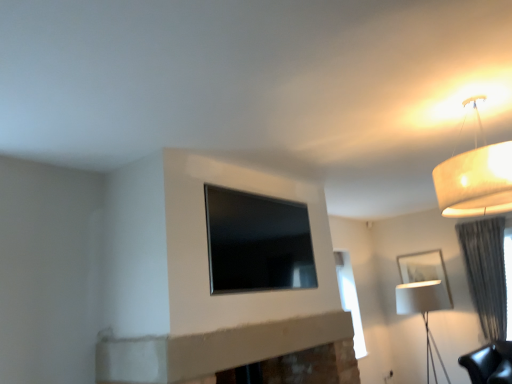
What do you see at coordinates (486, 272) in the screenshot?
I see `gray textured curtain at right` at bounding box center [486, 272].

Image resolution: width=512 pixels, height=384 pixels. What are the coordinates of `matte white lampshade at upper right, the first lamp from the front` in the screenshot? It's located at (475, 177).

Measure the distance between white matte picture frame at right and camera.

white matte picture frame at right and camera are 5.87 meters apart.

Where is `white fabric lampshade at right, the first lamp viewed from the back`? This screenshot has height=384, width=512. white fabric lampshade at right, the first lamp viewed from the back is located at coordinates (424, 311).

This screenshot has height=384, width=512. Find the location of `gray textured curtain at right`. gray textured curtain at right is located at coordinates (486, 272).

From a real-world perspective, who is located higher, white matte picture frame at right or gray textured curtain at right?

From a 3D spatial view, white matte picture frame at right is above.

Do you think white matte picture frame at right is within gray textured curtain at right, or outside of it?

white matte picture frame at right cannot be found inside gray textured curtain at right.

Is white matte picture frame at right further to the viewer compared to gray textured curtain at right?

Yes, it is behind gray textured curtain at right.

Which object is thinner, white matte picture frame at right or gray textured curtain at right?

Thinner between the two is white matte picture frame at right.

From the image's perspective, is white matte picture frame at right above or below black glass window at center?

white matte picture frame at right is below black glass window at center.

Which of these two, white matte picture frame at right or black glass window at center, is wider?

white matte picture frame at right is wider.

Is white matte picture frame at right positioned with its back to black glass window at center?

No.

Is the depth of white matte picture frame at right greater than that of black glass window at center?

Yes, it is.

Locate an element on the screen. This screenshot has height=384, width=512. lamp on the left of white fabric lampshade at right, placed as the second lamp when sorted from top to bottom is located at coordinates (475, 177).

Which point is more forward, (417, 284) or (467, 102)?

Answer: The point (467, 102) is closer to the camera.

From the image's perspective, which object appears higher, white fabric lampshade at right, placed as the 1th lamp when sorted from right to left, or matte white lampshade at upper right, positioned as the second lamp in back-to-front order?

matte white lampshade at upper right, positioned as the second lamp in back-to-front order, is shown above in the image.

Is white fabric lampshade at right, the first lamp viewed from the back, to the left of matte white lampshade at upper right, the second lamp when ordered from bottom to top, from the viewer's perspective?

In fact, white fabric lampshade at right, the first lamp viewed from the back, is to the right of matte white lampshade at upper right, the second lamp when ordered from bottom to top.

From the image's perspective, which is above, matte white lampshade at upper right, which appears as the first lamp when viewed from the top, or black glass window at center?

matte white lampshade at upper right, which appears as the first lamp when viewed from the top, from the image's perspective.

Based on the photo, from a real-world perspective, between matte white lampshade at upper right, the second lamp in the right-to-left sequence, and black glass window at center, who is vertically lower?

In real-world perspective, black glass window at center is lower.

Which is more to the left, matte white lampshade at upper right, positioned as the second lamp in back-to-front order, or black glass window at center?

Positioned to the left is black glass window at center.

Can we say matte white lampshade at upper right, the first lamp from the front, lies outside black glass window at center?

Absolutely, matte white lampshade at upper right, the first lamp from the front, is external to black glass window at center.

Considering the points (209, 190) and (431, 300), which point is behind, point (209, 190) or point (431, 300)?

Point (431, 300)

Looking at this image, from the image's perspective, does black glass window at center appear lower than white fabric lampshade at right, placed as the 1th lamp when sorted from right to left?

No, from the image's perspective, black glass window at center is not beneath white fabric lampshade at right, placed as the 1th lamp when sorted from right to left.

Is black glass window at center positioned far away from white fabric lampshade at right, placed as the 2th lamp when sorted from front to back?

Yes, black glass window at center is far from white fabric lampshade at right, placed as the 2th lamp when sorted from front to back.

Is black glass window at center at the left side of white fabric lampshade at right, placed as the 1th lamp when sorted from right to left?

Correct, you'll find black glass window at center to the left of white fabric lampshade at right, placed as the 1th lamp when sorted from right to left.

From a real-world perspective, which object rests below the other?

white fabric lampshade at right, acting as the 1th lamp starting from the bottom, from a real-world perspective.

Between point (401, 257) and point (412, 304), which one is positioned behind?

The point (401, 257) is farther.

Are white matte picture frame at right and white fabric lampshade at right, placed as the second lamp when sorted from top to bottom, making contact?

Yes, white matte picture frame at right is in contact with white fabric lampshade at right, placed as the second lamp when sorted from top to bottom.

How far apart are white matte picture frame at right and white fabric lampshade at right, acting as the 1th lamp starting from the bottom?

A distance of 8.61 centimeters exists between white matte picture frame at right and white fabric lampshade at right, acting as the 1th lamp starting from the bottom.

Is black glass window at center located within white fabric lampshade at right, placed as the 2th lamp when sorted from front to back?

Definitely not — black glass window at center is not inside white fabric lampshade at right, placed as the 2th lamp when sorted from front to back.

From a real-world perspective, is white fabric lampshade at right, the first lamp viewed from the back, above or below black glass window at center?

From a real-world perspective, white fabric lampshade at right, the first lamp viewed from the back, is physically below black glass window at center.

Considering the sizes of objects white fabric lampshade at right, which is the 2th lamp in left-to-right order, and black glass window at center in the image provided, who is smaller, white fabric lampshade at right, which is the 2th lamp in left-to-right order, or black glass window at center?

black glass window at center is smaller.

Image resolution: width=512 pixels, height=384 pixels. I want to click on picture frame above the gray textured curtain at right (from a real-world perspective), so click(422, 283).

This screenshot has height=384, width=512. Find the location of `picture frame that appears below the black glass window at center (from a real-world perspective)`. picture frame that appears below the black glass window at center (from a real-world perspective) is located at coordinates (422, 283).

Considering their positions, is white matte picture frame at right positioned further to black glass window at center than gray textured curtain at right?

Among the two, white matte picture frame at right is located further to black glass window at center.

Which object lies nearer to the anchor point black glass window at center, matte white lampshade at upper right, the second lamp when ordered from bottom to top, or white fabric lampshade at right, acting as the 1th lamp starting from the bottom?

The object closer to black glass window at center is matte white lampshade at upper right, the second lamp when ordered from bottom to top.

Looking at the image, which one is located closer to gray textured curtain at right, white fabric lampshade at right, placed as the second lamp when sorted from top to bottom, or matte white lampshade at upper right, the first lamp from the front?

Among the two, white fabric lampshade at right, placed as the second lamp when sorted from top to bottom, is located nearer to gray textured curtain at right.

Which object lies further to the anchor point white fabric lampshade at right, placed as the 1th lamp when sorted from right to left, black glass window at center or matte white lampshade at upper right, the second lamp when ordered from bottom to top?

matte white lampshade at upper right, the second lamp when ordered from bottom to top, is further to white fabric lampshade at right, placed as the 1th lamp when sorted from right to left.

Considering their positions, is gray textured curtain at right positioned closer to white fabric lampshade at right, acting as the 1th lamp starting from the bottom, than black glass window at center?

gray textured curtain at right lies closer to white fabric lampshade at right, acting as the 1th lamp starting from the bottom, than the other object.

When comparing their distances from white fabric lampshade at right, acting as the 1th lamp starting from the bottom, does black glass window at center or white matte picture frame at right seem further?

black glass window at center is further to white fabric lampshade at right, acting as the 1th lamp starting from the bottom.

Consider the image. Based on their spatial positions, is matte white lampshade at upper right, which appears as the first lamp when viewed from the top, or gray textured curtain at right further from white fabric lampshade at right, which is the 2th lamp in left-to-right order?

matte white lampshade at upper right, which appears as the first lamp when viewed from the top, is positioned further to the anchor white fabric lampshade at right, which is the 2th lamp in left-to-right order.

Estimate the real-world distances between objects in this image. Which object is further from white matte picture frame at right, white fabric lampshade at right, placed as the 1th lamp when sorted from right to left, or black glass window at center?

Among the two, black glass window at center is located further to white matte picture frame at right.

The image size is (512, 384). I want to click on window between matte white lampshade at upper right, the first lamp from the front, and gray textured curtain at right, along the z-axis, so (257, 242).

Find the location of a particular element. The height and width of the screenshot is (384, 512). lamp positioned between black glass window at center and white matte picture frame at right from near to far is located at coordinates (424, 311).

The width and height of the screenshot is (512, 384). In order to click on window between matte white lampshade at upper right, the second lamp in the right-to-left sequence, and white fabric lampshade at right, the first lamp viewed from the back, in the front-back direction in this screenshot , I will do `click(257, 242)`.

Find the location of a particular element. This screenshot has width=512, height=384. lamp located between matte white lampshade at upper right, positioned as the second lamp in back-to-front order, and white matte picture frame at right in the depth direction is located at coordinates (424, 311).